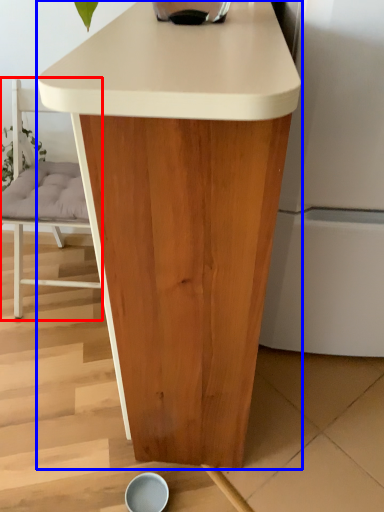
Question: Among these objects, which one is farthest to the camera, chair (highlighted by a red box) or table (highlighted by a blue box)?

Choices:
 (A) chair
 (B) table

Answer: (A)